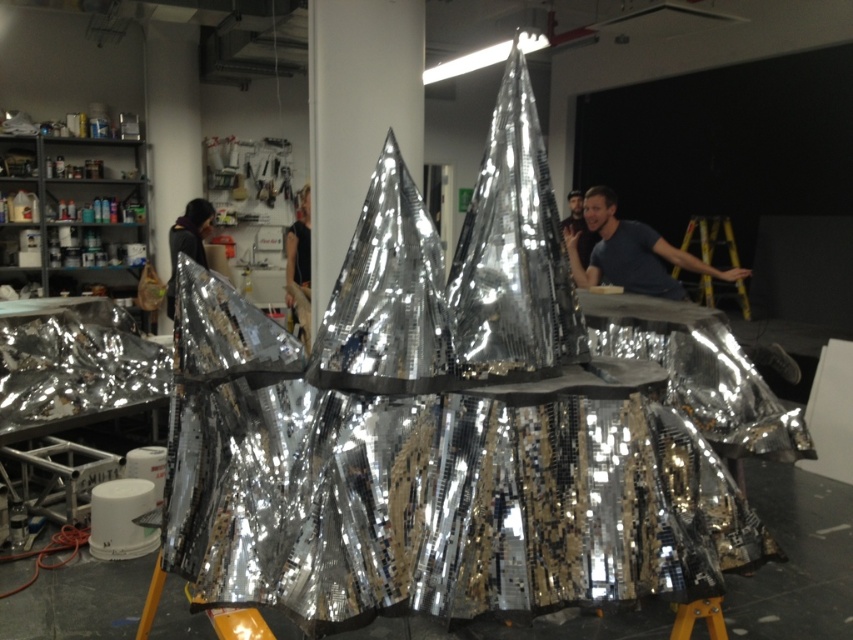
Is point (643, 253) positioned after point (293, 237)?

No, (643, 253) is closer to viewer.

Who is higher up, matte blue shirt at upper right or metallic silver jacket at center?

metallic silver jacket at center is higher up.

Locate an element on the screen. This screenshot has width=853, height=640. matte blue shirt at upper right is located at coordinates (631, 252).

Identify the location of matte blue shirt at upper right. (631, 252).

In the scene shown: Is metallic silver jacket at center in front of dark brown leather jacket at center?

No, it is behind dark brown leather jacket at center.

This screenshot has height=640, width=853. What do you see at coordinates (299, 244) in the screenshot?
I see `metallic silver jacket at center` at bounding box center [299, 244].

At what (x,y) coordinates should I click in order to perform the action: click on metallic silver jacket at center. Please return your answer as a coordinate pair (x, y). The image size is (853, 640). Looking at the image, I should click on (299, 244).

Who is taller, matte blue shirt at upper right or dark brown leather jacket at center?

With more height is dark brown leather jacket at center.

How distant is matte blue shirt at upper right from dark brown leather jacket at center?

matte blue shirt at upper right and dark brown leather jacket at center are 3.58 meters apart.

Describe the element at coordinates (631, 252) in the screenshot. The width and height of the screenshot is (853, 640). I see `matte blue shirt at upper right` at that location.

Where is `matte blue shirt at upper right`? Image resolution: width=853 pixels, height=640 pixels. matte blue shirt at upper right is located at coordinates (631, 252).